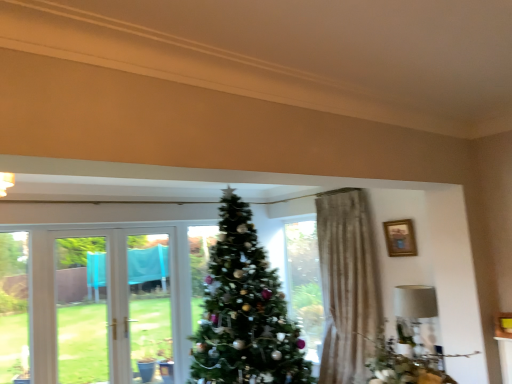
What do you see at coordinates (400, 238) in the screenshot?
I see `wooden framed picture at upper right` at bounding box center [400, 238].

What is the approximate height of green textured christmas tree at center?

green textured christmas tree at center is 2.26 meters in height.

The image size is (512, 384). Identify the location of white fabric lampshade at right. (415, 301).

The height and width of the screenshot is (384, 512). In order to click on wooden framed picture at upper right in this screenshot , I will do `click(400, 238)`.

Is green textured christmas tree at center placed right next to white fabric lampshade at right?

No, green textured christmas tree at center is not next to white fabric lampshade at right.

Relative to white fabric lampshade at right, is green textured christmas tree at center in front or behind?

green textured christmas tree at center is in front of white fabric lampshade at right.

From a real-world perspective, which is physically below, green textured christmas tree at center or white fabric lampshade at right?

white fabric lampshade at right, from a real-world perspective.

Is white fabric lampshade at right located within green textured christmas tree at center?

No, white fabric lampshade at right is not surrounded by green textured christmas tree at center.

From the picture: Is white fabric lampshade at right next to wooden framed picture at upper right?

white fabric lampshade at right is not next to wooden framed picture at upper right, and they're not touching.

Where is `lamp on the right of wooden framed picture at upper right`? Image resolution: width=512 pixels, height=384 pixels. lamp on the right of wooden framed picture at upper right is located at coordinates (415, 301).

Can we say white fabric lampshade at right lies outside wooden framed picture at upper right?

Yes, white fabric lampshade at right is located beyond the bounds of wooden framed picture at upper right.

Would you consider wooden framed picture at upper right to be distant from green textured christmas tree at center?

Yes.

From their relative heights in the image, would you say wooden framed picture at upper right is taller or shorter than green textured christmas tree at center?

In the image, wooden framed picture at upper right appears to be shorter than green textured christmas tree at center.

From a real-world perspective, relative to green textured christmas tree at center, is wooden framed picture at upper right vertically above or below?

Clearly, from a real-world perspective, wooden framed picture at upper right is above green textured christmas tree at center.

Relative to wooden framed picture at upper right, is green textured christmas tree at center in front or behind?

Visually, green textured christmas tree at center is located in front of wooden framed picture at upper right.

From the image's perspective, is green textured christmas tree at center above or below wooden framed picture at upper right?

From the image's perspective, green textured christmas tree at center appears below wooden framed picture at upper right.

Identify the location of christmas tree in front of the wooden framed picture at upper right. (245, 312).

Can we say green textured christmas tree at center lies outside wooden framed picture at upper right?

That's correct, green textured christmas tree at center is outside of wooden framed picture at upper right.

From the image's perspective, which object appears higher, wooden framed picture at upper right or white fabric lampshade at right?

wooden framed picture at upper right.

Who is bigger, wooden framed picture at upper right or white fabric lampshade at right?

white fabric lampshade at right is bigger.

Which object is further away from the camera taking this photo, wooden framed picture at upper right or white fabric lampshade at right?

wooden framed picture at upper right is more distant.

Which is more to the right, wooden framed picture at upper right or white fabric lampshade at right?

white fabric lampshade at right.

Is white fabric lampshade at right completely or partially outside of green textured christmas tree at center?

Yes, white fabric lampshade at right is outside of green textured christmas tree at center.

Between white fabric lampshade at right and green textured christmas tree at center, which one is positioned in front?

green textured christmas tree at center is in front.

Is white fabric lampshade at right smaller than green textured christmas tree at center?

Yes, white fabric lampshade at right is smaller than green textured christmas tree at center.

Locate an element on the screen. The height and width of the screenshot is (384, 512). christmas tree above the white fabric lampshade at right (from the image's perspective) is located at coordinates (245, 312).

I want to click on lamp below the green textured christmas tree at center (from a real-world perspective), so click(x=415, y=301).

At what (x,y) coordinates should I click in order to perform the action: click on picture frame on the left of white fabric lampshade at right. Please return your answer as a coordinate pair (x, y). Looking at the image, I should click on (400, 238).

Considering their positions, is wooden framed picture at upper right positioned further to green textured christmas tree at center than white fabric lampshade at right?

wooden framed picture at upper right is further to green textured christmas tree at center.

Looking at the image, which one is located closer to wooden framed picture at upper right, green textured christmas tree at center or white fabric lampshade at right?

white fabric lampshade at right is closer to wooden framed picture at upper right.

Looking at the image, which one is located closer to white fabric lampshade at right, green textured christmas tree at center or wooden framed picture at upper right?

wooden framed picture at upper right is positioned closer to the anchor white fabric lampshade at right.

Estimate the real-world distances between objects in this image. Which object is closer to green textured christmas tree at center, white fabric lampshade at right or wooden framed picture at upper right?

white fabric lampshade at right.

Considering their positions, is white fabric lampshade at right positioned closer to wooden framed picture at upper right than green textured christmas tree at center?

The object closer to wooden framed picture at upper right is white fabric lampshade at right.

Considering their positions, is wooden framed picture at upper right positioned closer to white fabric lampshade at right than green textured christmas tree at center?

wooden framed picture at upper right is closer to white fabric lampshade at right.

Locate an element on the screen. picture frame between green textured christmas tree at center and white fabric lampshade at right is located at coordinates (400, 238).